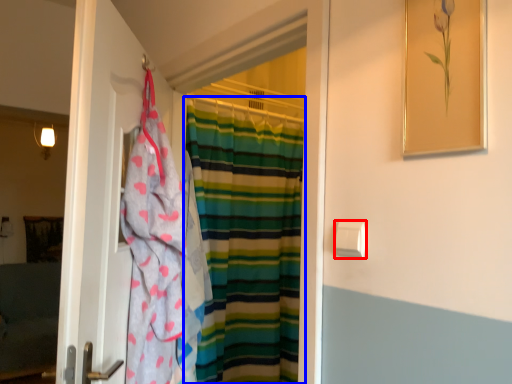
Question: Which object appears farthest to the camera in this image, towel bar (highlighted by a red box) or curtain (highlighted by a blue box)?

Choices:
 (A) towel bar
 (B) curtain

Answer: (B)